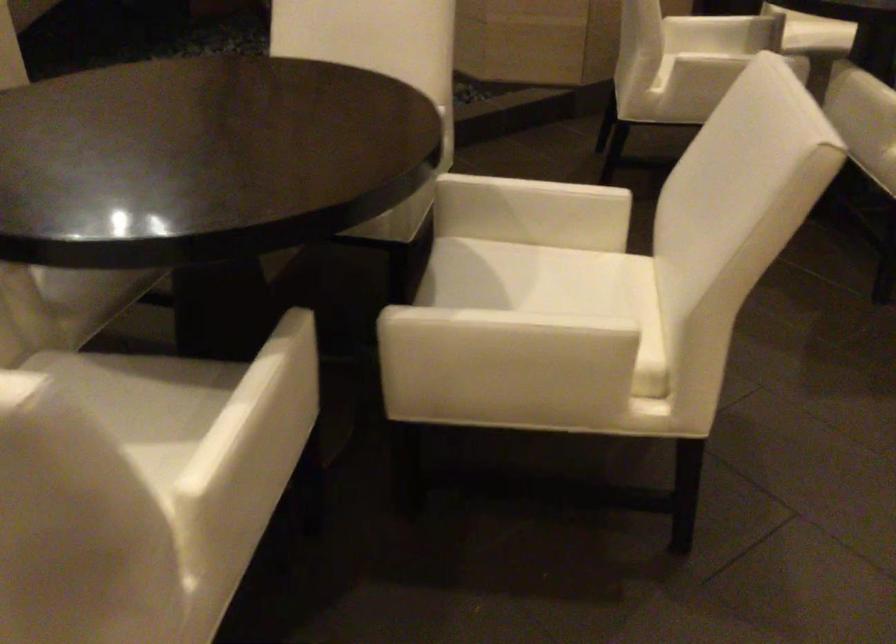
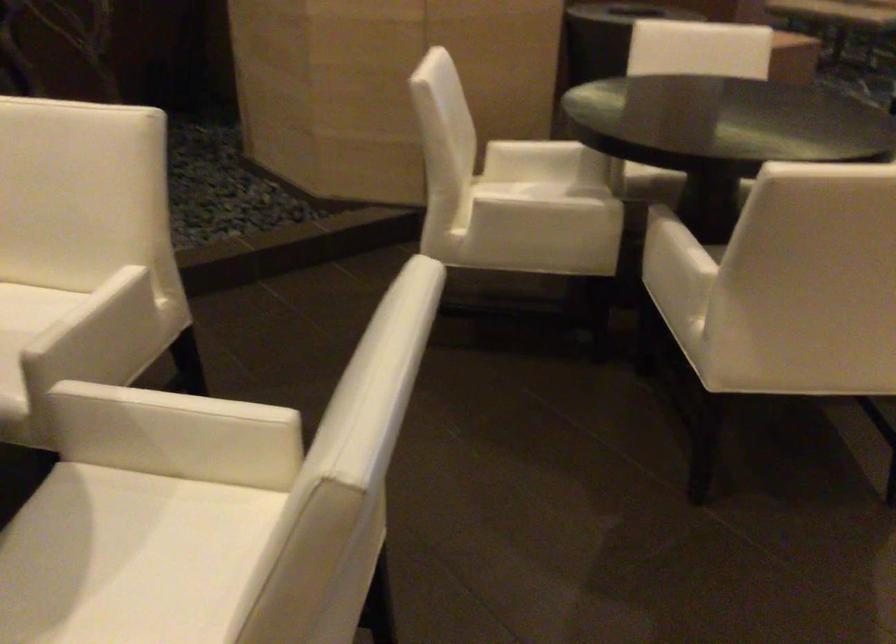
Question: Based on the continuous images, in which direction is the camera rotating? Reply with the corresponding letter.

Choices:
 (A) Left
 (B) Right
 (C) Up
 (D) Down

Answer: (C)